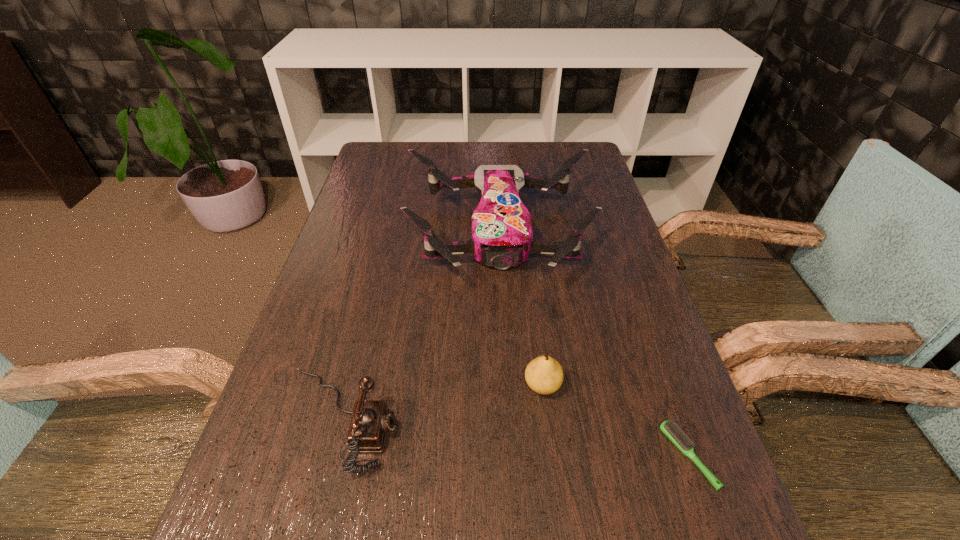
You are a GUI agent. You are given a task and a screenshot of the screen. Output one action in this format:
    pyautogui.click(x=<x>, y=<y>)
    Task: Click on the drone
    The image size is (960, 540).
    Given the screenshot: What is the action you would take?
    pyautogui.click(x=502, y=233)

Find the location of a particular element. This screenshot has height=540, width=960. the farthest object is located at coordinates (502, 233).

The image size is (960, 540). In order to click on pear in this screenshot , I will do `click(544, 375)`.

I want to click on telephone, so click(x=371, y=419).

Locate an element on the screen. The height and width of the screenshot is (540, 960). hairbrush is located at coordinates (671, 430).

What are the coordinates of `vacant region located on the front-facing side of the drone` in the screenshot? It's located at (510, 420).

Locate an element on the screen. blank space located 0.120m on the left of the pear is located at coordinates (461, 385).

You are a GUI agent. You are given a task and a screenshot of the screen. Output one action in this format:
    pyautogui.click(x=<x>, y=<y>)
    Task: Click on the vacant space located 0.180m on the dial of the telephone
    The width and height of the screenshot is (960, 540).
    Given the screenshot: What is the action you would take?
    pyautogui.click(x=501, y=420)

At what (x,y) coordinates should I click in order to perform the action: click on free space located on the left of the shortest object. Please return your answer as a coordinate pair (x, y). Looking at the image, I should click on (445, 456).

Identify the location of object that is at the left edge. The width and height of the screenshot is (960, 540). (371, 419).